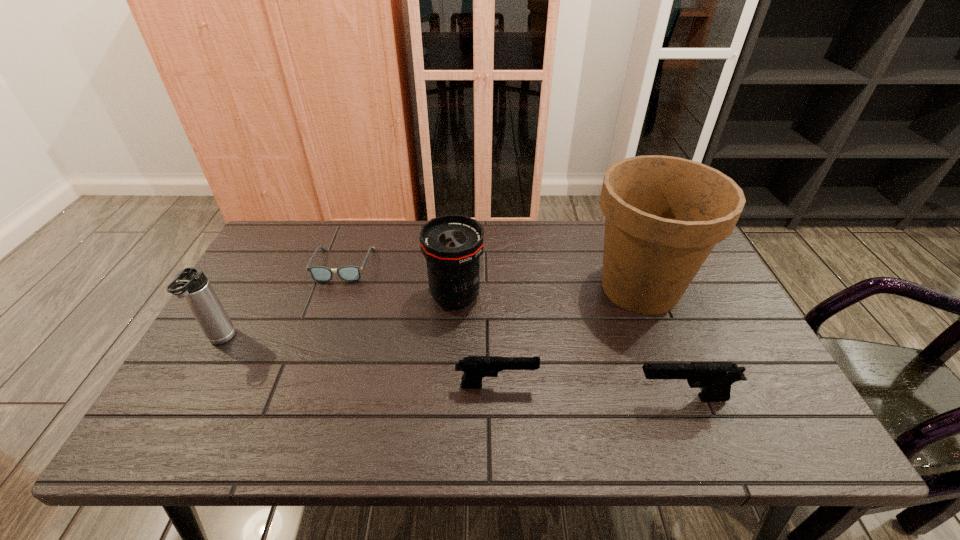
I want to click on pistol that is at the right edge, so click(715, 378).

Where is `flowerpot at the right edge`? This screenshot has width=960, height=540. flowerpot at the right edge is located at coordinates [x=663, y=215].

The height and width of the screenshot is (540, 960). Identify the location of object located in the far right corner section of the desktop. (663, 215).

Locate an element on the screen. Image resolution: width=960 pixels, height=540 pixels. object at the near right corner is located at coordinates (715, 378).

Identify the location of blank area at the far edge. (535, 224).

Image resolution: width=960 pixels, height=540 pixels. What are the coordinates of `blank area at the near edge` in the screenshot? It's located at (523, 392).

In the image, there is a desktop. At what (x,y) coordinates should I click in order to perform the action: click on free region at the left edge. Please return your answer as a coordinate pair (x, y). This screenshot has width=960, height=540. Looking at the image, I should click on (252, 371).

The height and width of the screenshot is (540, 960). In the image, there is a desktop. Identify the location of free space at the right edge. (702, 284).

The width and height of the screenshot is (960, 540). I want to click on vacant point at the far left corner, so click(x=310, y=243).

The height and width of the screenshot is (540, 960). Identify the location of free space between the telephoto lens and the shorter pistol. (476, 341).